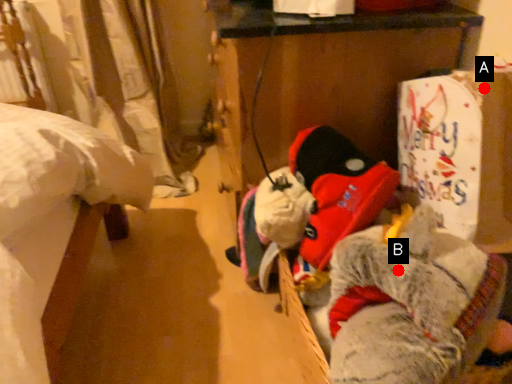
Question: Two points are circled on the image, labeled by A and B beside each circle. Which of the following is the closest to the observer?

Choices:
 (A) A is closer
 (B) B is closer

Answer: (B)